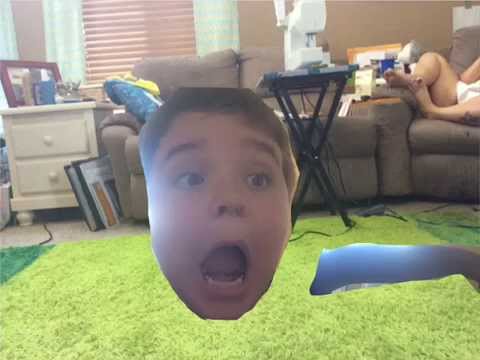
Identify the location of curtain. This screenshot has width=480, height=360. (61, 37).